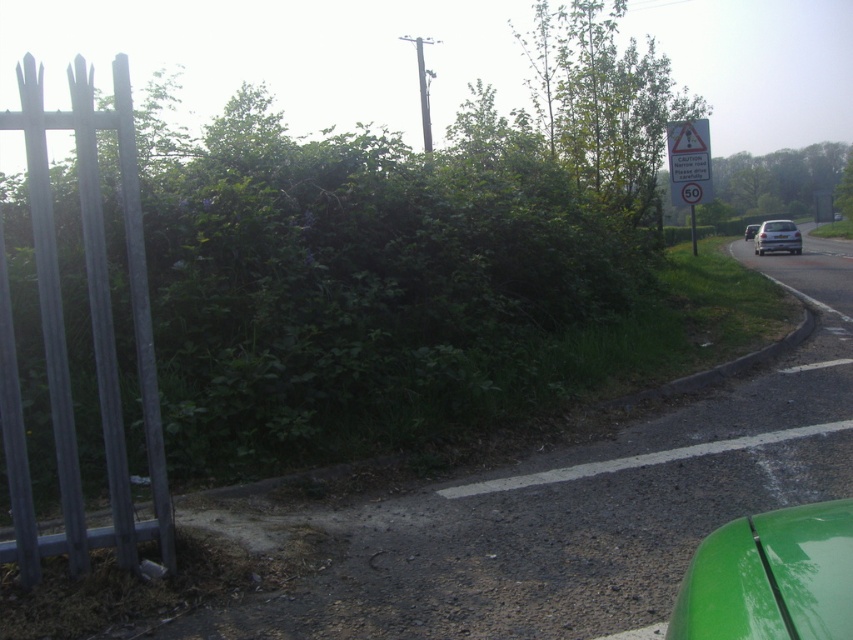
You are driving a car and need to determine if there is enough space to safely pass the matte silver van at right before reaching the metallic gray fence at left. The safe passing distance required is 50 meters. Based on the scene, can you safely pass the van?

The distance between the metallic gray fence at left and the matte silver van at right is 46.64 meters. Since the required safe passing distance is 50 meters, you do not have enough space to safely pass the matte silver van at right before reaching the metallic gray fence at left.

You are driving a car and want to know if there is enough space to safely pass through the gap between the green leafy hedge at left and the road edge. The minimum required distance for safe passage is 5 meters. Can you safely pass through?

The distance between the green leafy hedge at left and the camera is 5.45 meters, which exceeds the minimum required 5 meters for safe passage. Therefore, it is safe to pass through.